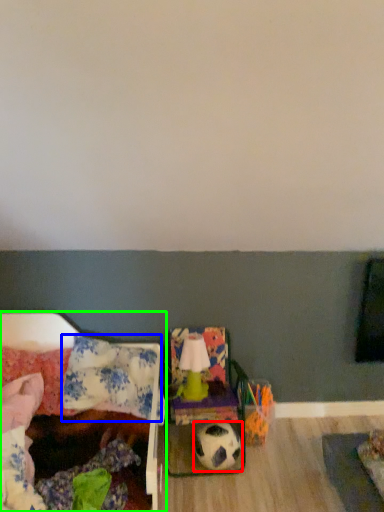
Question: Which is farther away from football (highlighted by a red box)? pillow (highlighted by a blue box) or furniture (highlighted by a green box)?

Choices:
 (A) pillow
 (B) furniture

Answer: (A)